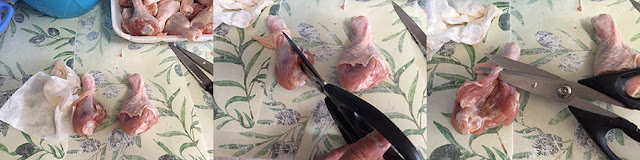
Identify the location of white bowl. The width and height of the screenshot is (640, 160). (134, 38).